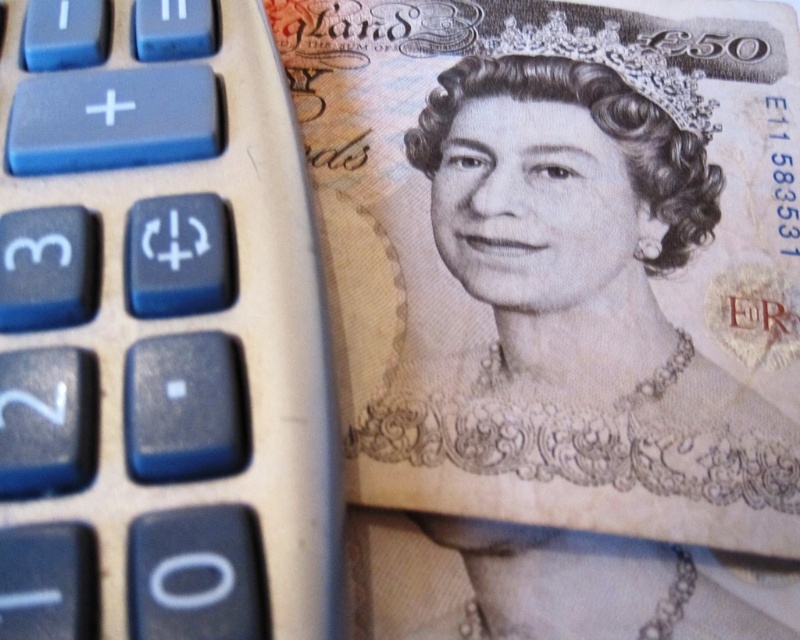
Is blue plastic calculator at left closer to camera compared to white textured tiara at upper center?

Yes, blue plastic calculator at left is in front of white textured tiara at upper center.

Does blue plastic calculator at left have a lesser width compared to white textured tiara at upper center?

No.

Who is more distant from viewer, (132,300) or (576,36)?

Point (576,36)

Where is `blue plastic calculator at left`? This screenshot has width=800, height=640. blue plastic calculator at left is located at coordinates (160, 332).

Can you confirm if blue plastic calculator at left is positioned to the right of smooth beige portrait at center?

Incorrect, blue plastic calculator at left is not on the right side of smooth beige portrait at center.

In the scene shown: Is blue plastic calculator at left shorter than smooth beige portrait at center?

Yes.

Who is more distant from viewer, (148, 248) or (548, 332)?

Positioned behind is point (548, 332).

Locate an element on the screen. This screenshot has height=640, width=800. blue plastic calculator at left is located at coordinates (160, 332).

This screenshot has width=800, height=640. What do you see at coordinates (580, 269) in the screenshot?
I see `smooth beige portrait at center` at bounding box center [580, 269].

Which is below, smooth beige portrait at center or white textured tiara at upper center?

Positioned lower is smooth beige portrait at center.

This screenshot has width=800, height=640. Identify the location of smooth beige portrait at center. (580, 269).